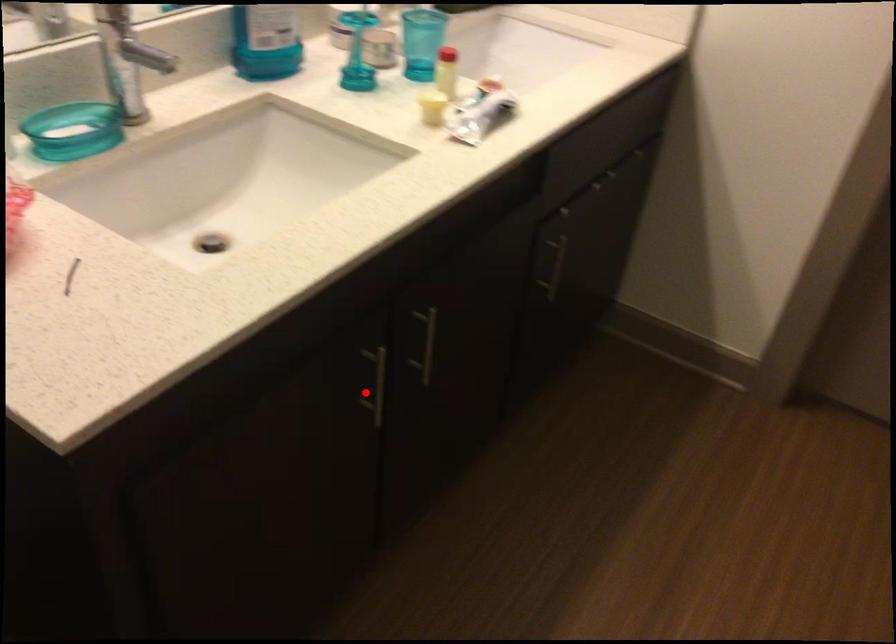
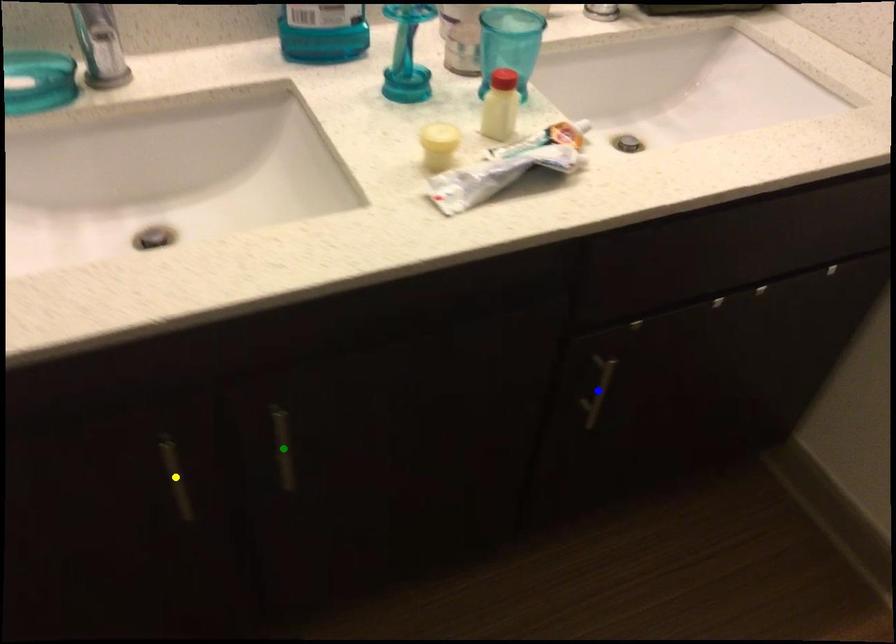
Question: I am providing you with two images of the same scene from different viewpoints. A red point is marked on the first image. You are given multiple points on the second image. Can you choose the point in image 2 that corresponds to the point in image 1?

Choices:
 (A) yellow point
 (B) green point
 (C) blue point

Answer: (A)